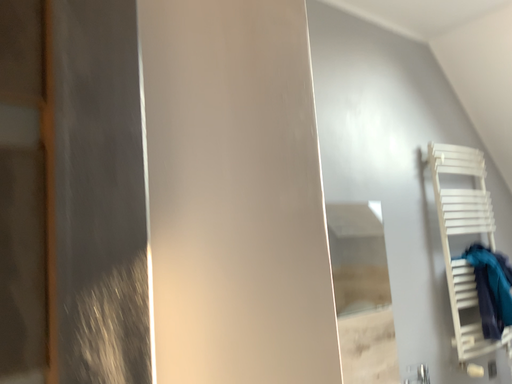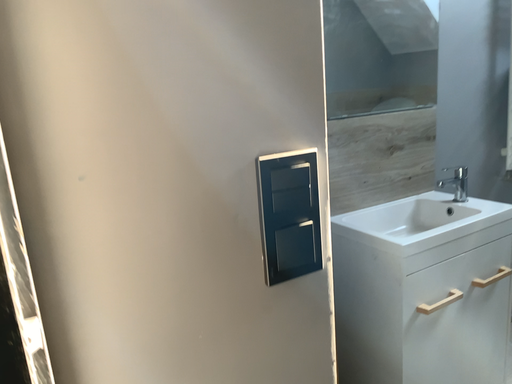
Question: Which way did the camera rotate in the video?

Choices:
 (A) rotated right
 (B) rotated left

Answer: (B)